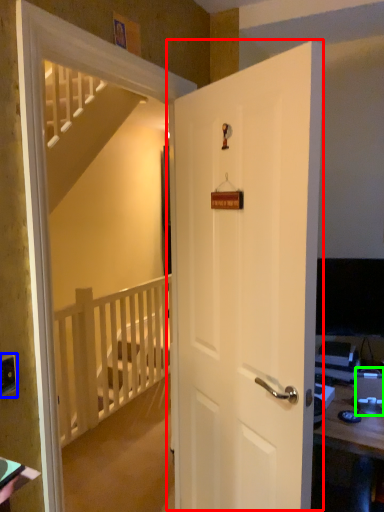
Question: Based on their relative distances, which object is farther from door (highlighted by a red box)? Choose from electric outlet (highlighted by a blue box) and desktop computer (highlighted by a green box).

Choices:
 (A) electric outlet
 (B) desktop computer

Answer: (A)